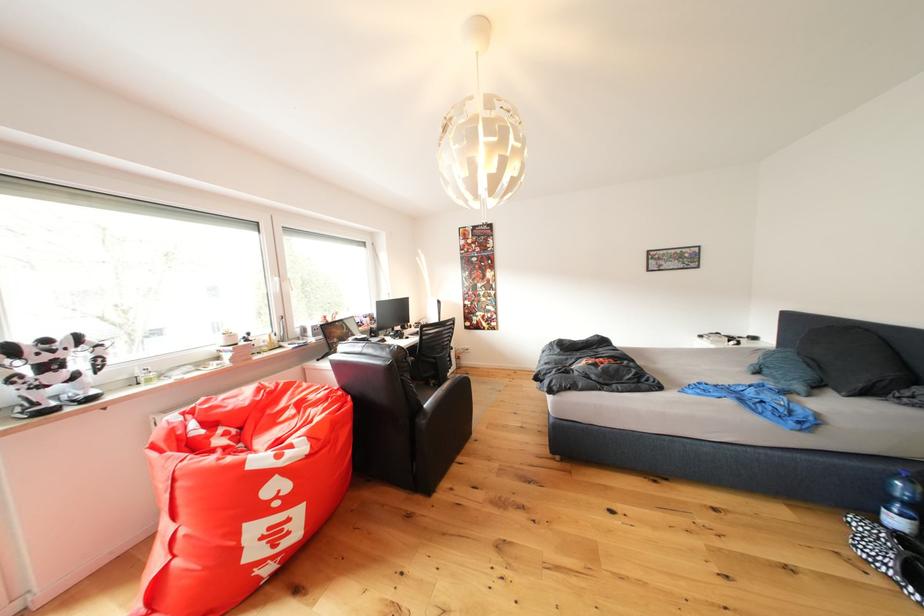
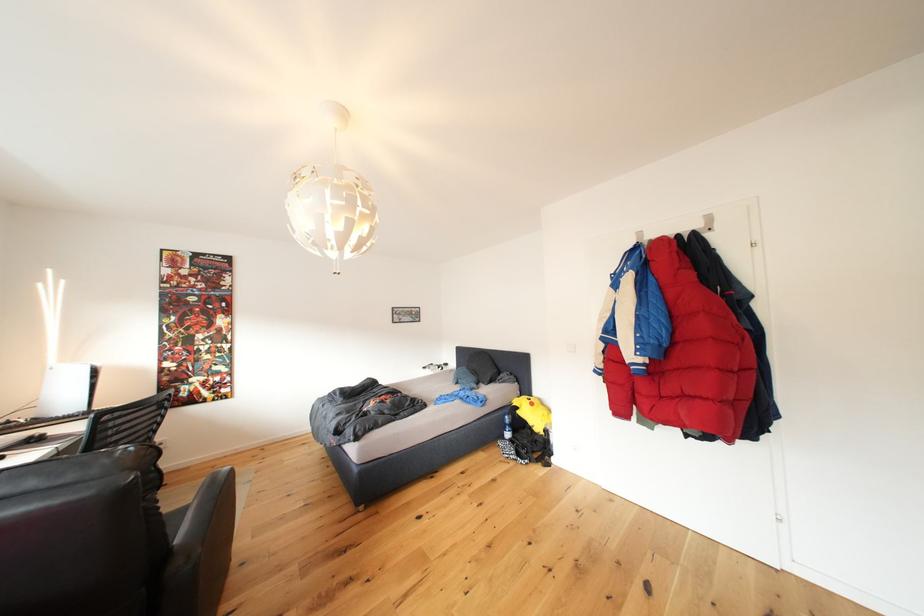
Question: The camera is either moving clockwise (left) or counter-clockwise (right) around the object. The first image is from the beginning of the video and the second image is from the end. Is the camera moving left or right when shooting the video?

Choices:
 (A) Left
 (B) Right

Answer: (A)